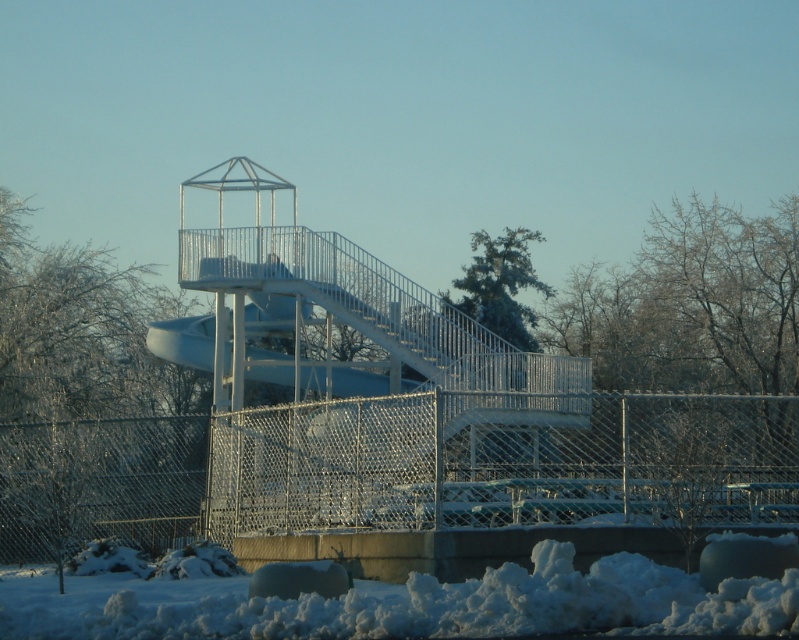
Does frosty white tree at upper left lie behind white fluffy snow at lower center?

Yes.

Is frosty white tree at upper left wider than white fluffy snow at lower center?

Indeed, frosty white tree at upper left has a greater width compared to white fluffy snow at lower center.

This screenshot has width=799, height=640. What do you see at coordinates (90, 403) in the screenshot?
I see `frosty white tree at upper left` at bounding box center [90, 403].

Find the location of `frosty white tree at upper left`. frosty white tree at upper left is located at coordinates (90, 403).

Does chain link fence at lower center have a lesser width compared to white fluffy snow at lower center?

Incorrect, chain link fence at lower center's width is not less than white fluffy snow at lower center's.

Is point (30, 452) positioned after point (640, 573)?

Yes, it is behind point (640, 573).

Is point (503, 518) less distant than point (161, 598)?

No, it is not.

I want to click on chain link fence at lower center, so click(396, 468).

Which is in front, point (590, 456) or point (98, 467)?

Point (590, 456) is in front.

Which is below, chain link fence at lower center or frosty white tree at upper left?

frosty white tree at upper left is below.

Which is behind, point (432, 525) or point (118, 268)?

The point (118, 268) is behind.

At what (x,y) coordinates should I click in order to perform the action: click on chain link fence at lower center. Please return your answer as a coordinate pair (x, y). Looking at the image, I should click on (396, 468).